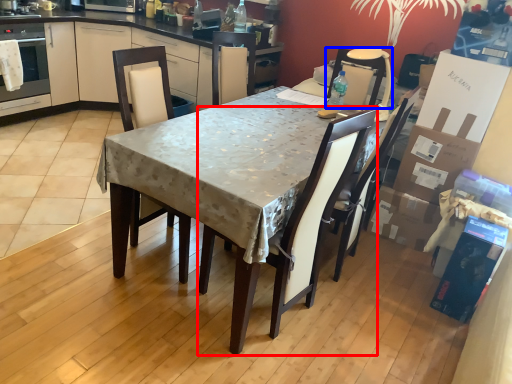
Question: Which object appears closest to the camera in this image, chair (highlighted by a red box) or chair (highlighted by a blue box)?

Choices:
 (A) chair
 (B) chair

Answer: (A)